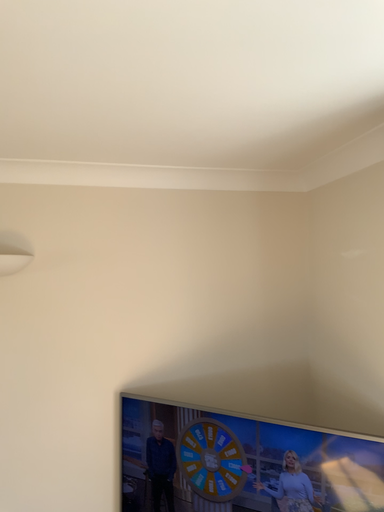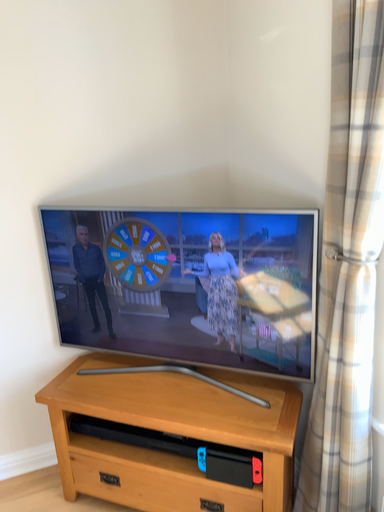
Question: How did the camera likely rotate when shooting the video?

Choices:
 (A) rotated upward
 (B) rotated downward

Answer: (B)